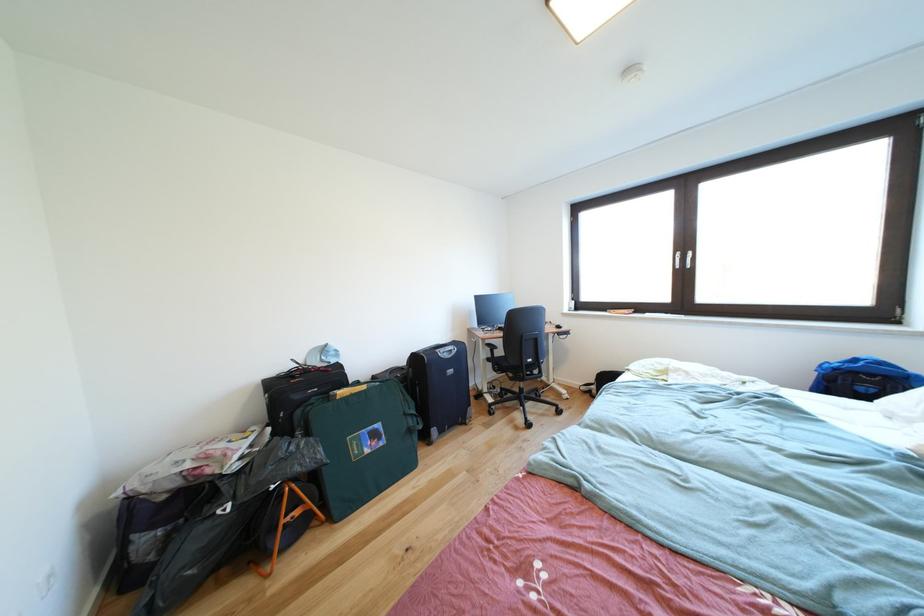
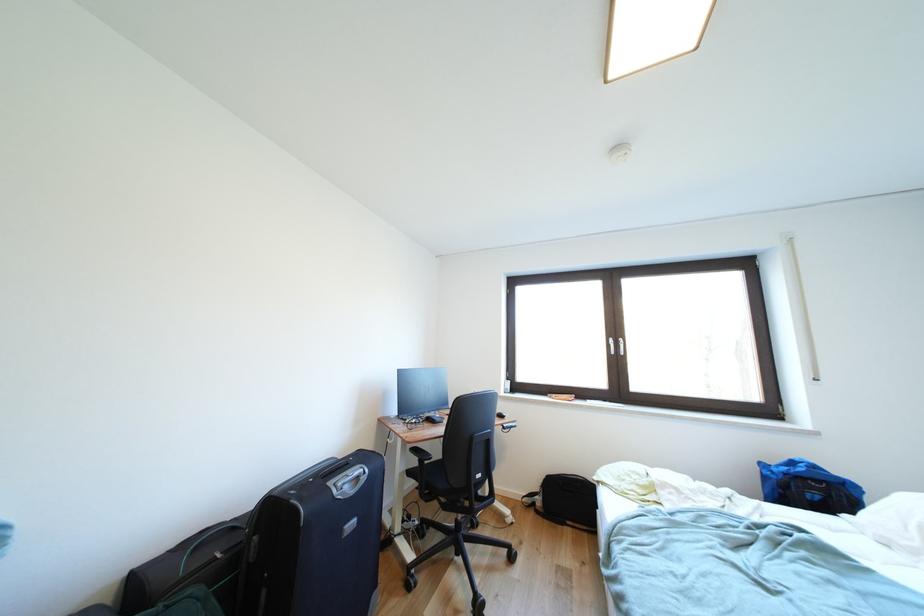
Question: What movement of the cameraman would produce the second image?

Choices:
 (A) Left
 (B) Right
 (C) Forward
 (D) Backward

Answer: (C)